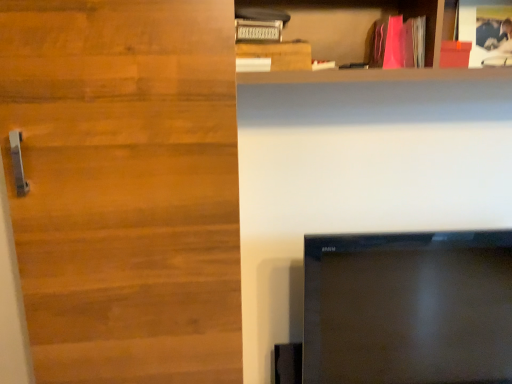
Image resolution: width=512 pixels, height=384 pixels. Describe the element at coordinates (486, 31) in the screenshot. I see `pink matte book at upper right` at that location.

The image size is (512, 384). In order to click on pink matte book at upper right in this screenshot , I will do `click(486, 31)`.

Describe the element at coordinates (358, 39) in the screenshot. The width and height of the screenshot is (512, 384). I see `matte wooden shelf at upper right` at that location.

Measure the distance between point (38,181) and camera.

Point (38,181) is 89.50 centimeters away from camera.

At what (x,y) coordinates should I click in order to perform the action: click on wooden plank at upper center. Please return your answer as a coordinate pair (x, y). This screenshot has height=384, width=512. Looking at the image, I should click on (279, 54).

The height and width of the screenshot is (384, 512). In order to click on pink matte book at upper right in this screenshot , I will do `click(486, 31)`.

Is pink matte book at upper right directly adjacent to matte wooden shelf at upper right?

pink matte book at upper right and matte wooden shelf at upper right are clearly separated.

Is pink matte book at upper right to the right of matte wooden shelf at upper right from the viewer's perspective?

Yes, pink matte book at upper right is to the right of matte wooden shelf at upper right.

Is pink matte book at upper right thinner than matte wooden shelf at upper right?

Yes.

Is wooden plank at upper center far away from wooden door at left?

No, wooden plank at upper center is not far away from wooden door at left.

From the image's perspective, which one is positioned higher, wooden plank at upper center or wooden door at left?

wooden plank at upper center.

Which of these two, wooden plank at upper center or wooden door at left, is thinner?

wooden plank at upper center.

Where is `shelf that appears above the wooden plank at upper center (from a real-world perspective)`? The height and width of the screenshot is (384, 512). shelf that appears above the wooden plank at upper center (from a real-world perspective) is located at coordinates click(x=358, y=39).

From the image's perspective, does matte wooden shelf at upper right appear lower than wooden plank at upper center?

Actually, matte wooden shelf at upper right appears above wooden plank at upper center in the image.

Between matte wooden shelf at upper right and wooden plank at upper center, which one is positioned in front?

matte wooden shelf at upper right is closer to the camera.

Who is shorter, matte wooden shelf at upper right or wooden plank at upper center?

wooden plank at upper center.

Can you confirm if matte wooden shelf at upper right is bigger than black glossy tv at lower right?

Indeed, matte wooden shelf at upper right has a larger size compared to black glossy tv at lower right.

Between matte wooden shelf at upper right and black glossy tv at lower right, which one has larger width?

matte wooden shelf at upper right.

From a real-world perspective, relative to black glossy tv at lower right, is matte wooden shelf at upper right vertically above or below?

matte wooden shelf at upper right is situated higher than black glossy tv at lower right in the real world.

Is pink matte book at upper right smaller than wooden door at left?

Indeed, pink matte book at upper right has a smaller size compared to wooden door at left.

Is pink matte book at upper right aimed at wooden door at left?

No, pink matte book at upper right is not oriented towards wooden door at left.

Is wooden door at left inside pink matte book at upper right?

No, wooden door at left is located outside of pink matte book at upper right.

Considering the relative positions of wooden door at left and wooden plank at upper center in the image provided, is wooden door at left to the left or to the right of wooden plank at upper center?

Clearly, wooden door at left is on the left of wooden plank at upper center in the image.

Is the depth of wooden door at left less than that of wooden plank at upper center?

Yes, wooden door at left is in front of wooden plank at upper center.

Could wooden plank at upper center be considered to be inside wooden door at left?

That's incorrect, wooden plank at upper center is not inside wooden door at left.

Is wooden door at left oriented towards wooden plank at upper center?

No, wooden door at left is not aimed at wooden plank at upper center.

Which object is further away from the camera, pink matte book at upper right or black glossy tv at lower right?

pink matte book at upper right is further away from the camera.

Is point (473, 57) positioned after point (361, 280)?

No, (473, 57) is in front of (361, 280).

Is pink matte book at upper right wider or thinner than black glossy tv at lower right?

Considering their sizes, pink matte book at upper right looks slimmer than black glossy tv at lower right.

Looking at this image, from the image's perspective, who appears lower, pink matte book at upper right or black glossy tv at lower right?

black glossy tv at lower right is shown below in the image.

The image size is (512, 384). In order to click on shelf lying below the pink matte book at upper right (from the image's perspective) in this screenshot , I will do `click(358, 39)`.

This screenshot has width=512, height=384. I want to click on cabinetry above the wooden door at left (from a real-world perspective), so click(279, 54).

Based on their spatial positions, is matte wooden shelf at upper right or wooden door at left further from wooden plank at upper center?

wooden door at left is further to wooden plank at upper center.

Which object lies further to the anchor point pink matte book at upper right, matte wooden shelf at upper right or wooden plank at upper center?

wooden plank at upper center lies further to pink matte book at upper right than the other object.

From the image, which object appears to be nearer to matte wooden shelf at upper right, pink matte book at upper right or wooden door at left?

The object closer to matte wooden shelf at upper right is pink matte book at upper right.

Which object lies further to the anchor point pink matte book at upper right, wooden plank at upper center or black glossy tv at lower right?

Based on the image, black glossy tv at lower right appears to be further to pink matte book at upper right.

Which object lies nearer to the anchor point pink matte book at upper right, wooden plank at upper center or wooden door at left?

wooden plank at upper center lies closer to pink matte book at upper right than the other object.

Looking at the image, which one is located further to wooden plank at upper center, matte wooden shelf at upper right or black glossy tv at lower right?

black glossy tv at lower right lies further to wooden plank at upper center than the other object.

Looking at the image, which one is located further to pink matte book at upper right, matte wooden shelf at upper right or wooden door at left?

Among the two, wooden door at left is located further to pink matte book at upper right.

From the image, which object appears to be nearer to black glossy tv at lower right, pink matte book at upper right or wooden door at left?

Among the two, wooden door at left is located nearer to black glossy tv at lower right.

You are a GUI agent. You are given a task and a screenshot of the screen. Output one action in this format:
    pyautogui.click(x=<x>, y=<y>)
    Task: Click on the shelf located between wooden door at left and black glossy tv at lower right in the left-right direction
    The height and width of the screenshot is (384, 512).
    Given the screenshot: What is the action you would take?
    pyautogui.click(x=358, y=39)

Find the location of `cabinetry between pink matte book at upper right and black glossy tv at lower right in the up-down direction`. cabinetry between pink matte book at upper right and black glossy tv at lower right in the up-down direction is located at coordinates (279, 54).

This screenshot has width=512, height=384. What are the coordinates of `cabinetry between wooden door at left and pink matte book at upper right` in the screenshot? It's located at (279, 54).

Find the location of a particular element. This screenshot has height=384, width=512. cabinetry between matte wooden shelf at upper right and black glossy tv at lower right in the vertical direction is located at coordinates (279, 54).